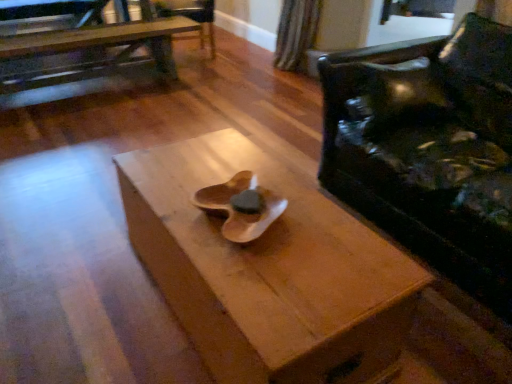
Question: Is wooden table at center, which ranks as the 1th table in bottom-to-top order, taller or shorter than wooden table at upper left, arranged as the 1th table when viewed from the back?

Choices:
 (A) short
 (B) tall

Answer: (A)

Question: Looking at their shapes, would you say wooden table at center, which is the second table from left to right, is wider or thinner than wooden table at upper left, placed as the first table when sorted from left to right?

Choices:
 (A) wide
 (B) thin

Answer: (A)

Question: Which object is positioned farthest from the wooden table at upper left, placed as the second table when sorted from front to back?

Choices:
 (A) wooden armchair at upper center
 (B) wooden table at center, which is counted as the 2th table, starting from the top
 (C) black leather couch at right

Answer: (B)

Question: Based on their relative distances, which object is farther from the wooden table at center, which is the second table from left to right?

Choices:
 (A) wooden armchair at upper center
 (B) black leather couch at right
 (C) wooden table at upper left, the second table ordered from the bottom

Answer: (A)